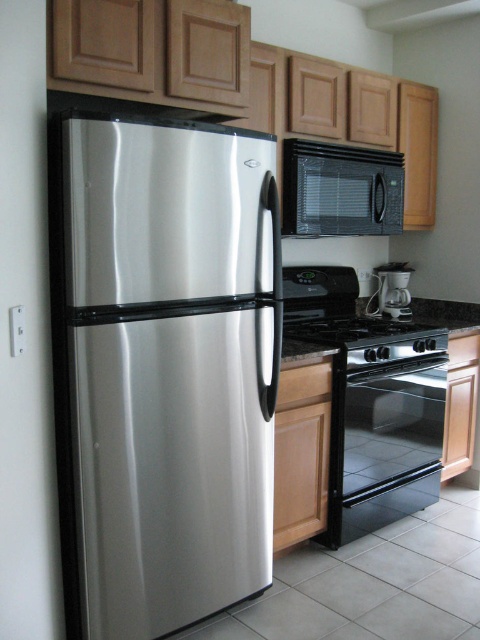
Based on the photo, you are planning to install a new kitchen appliance and need to know the exact position of the stainless steel refrigerator at left. What are the coordinates of its location?

The stainless steel refrigerator at left is located at point (167, 371).

You are a kitchen designer planning to install a new appliance. You have a satin black microwave at upper center and a white plastic coffee maker at center. Which appliance should you place higher to maintain proper kitchen ergonomics?

The satin black microwave at upper center should be placed higher since it is taller than the white plastic coffee maker at center, ensuring it fits within the kitchen space without obstructing other appliances.

You are a kitchen designer planning to install a new shelf between the satin black microwave at upper center and the white plastic coffee maker at center. Based on their positions, where should the shelf be placed?

The shelf should be placed between the satin black microwave at upper center and the white plastic coffee maker at center since the microwave is positioned over the coffee maker, indicating vertical alignment.